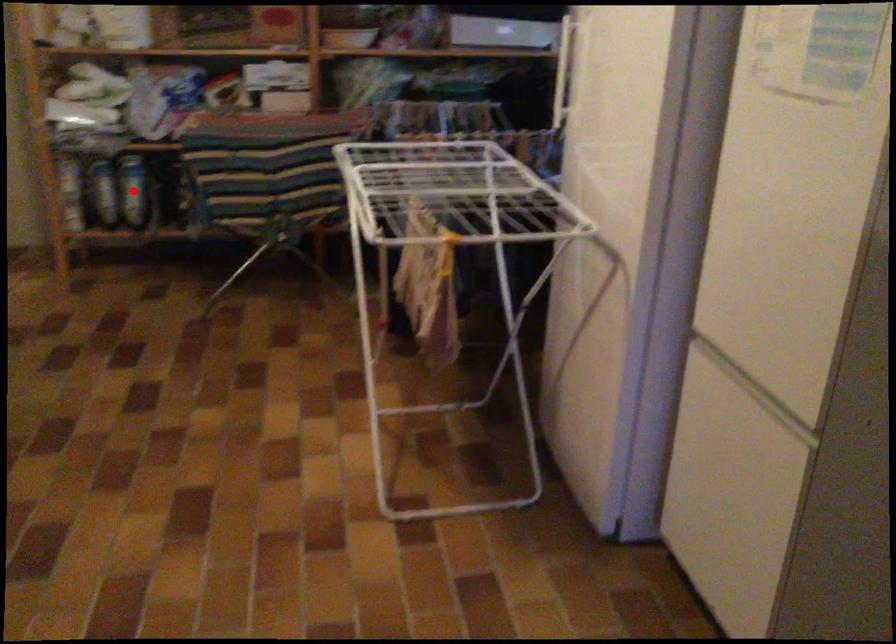
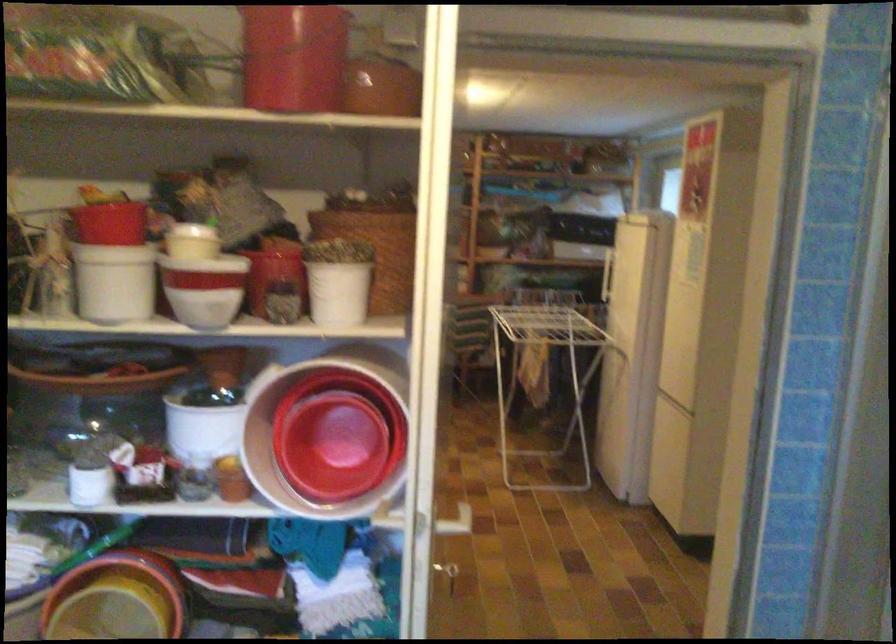
Question: I am providing you with two images of the same scene from different viewpoints. A red point is marked on the first image. Can you still see the location of the red point in image 2?

Choices:
 (A) Yes
 (B) No

Answer: (B)